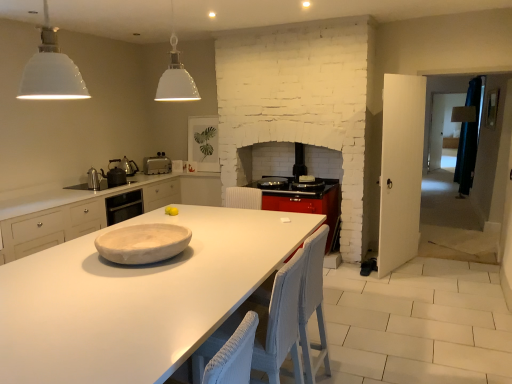
Question: Considering the relative sizes of metallic silver kettle at left, which is the 2th appliance from back to front, and white marble platter at center in the image provided, is metallic silver kettle at left, which is the 2th appliance from back to front, taller than white marble platter at center?

Choices:
 (A) yes
 (B) no

Answer: (A)

Question: Considering the relative sizes of metallic silver kettle at left, acting as the third appliance starting from the front, and white marble platter at center in the image provided, is metallic silver kettle at left, acting as the third appliance starting from the front, wider than white marble platter at center?

Choices:
 (A) no
 (B) yes

Answer: (A)

Question: Considering the relative sizes of metallic silver kettle at left, acting as the third appliance starting from the front, and white marble platter at center in the image provided, is metallic silver kettle at left, acting as the third appliance starting from the front, shorter than white marble platter at center?

Choices:
 (A) no
 (B) yes

Answer: (A)

Question: Is metallic silver kettle at left, acting as the third appliance starting from the front, turned away from white marble platter at center?

Choices:
 (A) yes
 (B) no

Answer: (B)

Question: From a real-world perspective, is metallic silver kettle at left, acting as the third appliance starting from the front, under white marble platter at center?

Choices:
 (A) yes
 (B) no

Answer: (B)

Question: Is white marble platter at center completely or partially inside metallic silver kettle at left, acting as the third appliance starting from the front?

Choices:
 (A) yes
 (B) no

Answer: (B)

Question: Is matte black kettle at left, placed as the 2th appliance when sorted from front to back, shorter than white marble platter at center?

Choices:
 (A) yes
 (B) no

Answer: (B)

Question: Can you see matte black kettle at left, placed as the 3th appliance when sorted from back to front, touching white marble platter at center?

Choices:
 (A) no
 (B) yes

Answer: (A)

Question: Is white marble platter at center located within matte black kettle at left, placed as the 2th appliance when sorted from front to back?

Choices:
 (A) yes
 (B) no

Answer: (B)

Question: Considering the relative sizes of matte black kettle at left, placed as the 3th appliance when sorted from back to front, and white marble platter at center in the image provided, is matte black kettle at left, placed as the 3th appliance when sorted from back to front, smaller than white marble platter at center?

Choices:
 (A) yes
 (B) no

Answer: (A)

Question: From the image's perspective, is matte black kettle at left, placed as the 2th appliance when sorted from front to back, below white marble platter at center?

Choices:
 (A) no
 (B) yes

Answer: (A)

Question: Are matte black kettle at left, placed as the 2th appliance when sorted from front to back, and white marble platter at center far apart?

Choices:
 (A) yes
 (B) no

Answer: (A)

Question: Can white matte pendant light at upper left, acting as the 2th light fixture starting from the right, be found inside metallic silver kettle at left, acting as the third appliance starting from the front?

Choices:
 (A) no
 (B) yes

Answer: (A)